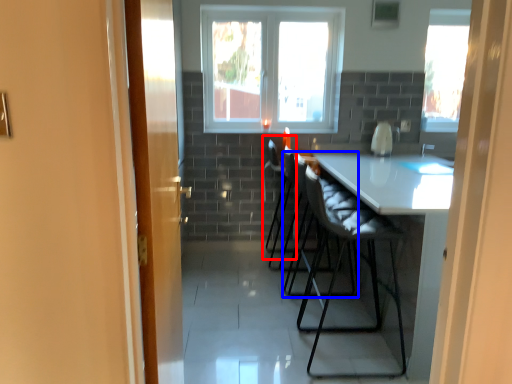
Question: Which point is further to the camera, chair (highlighted by a red box) or folding chair (highlighted by a blue box)?

Choices:
 (A) chair
 (B) folding chair

Answer: (A)